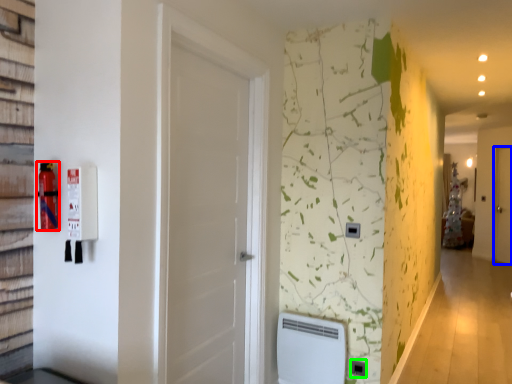
Question: Which object is positioned farthest from extinguisher (highlighted by a red box)? Select from door (highlighted by a blue box) and electric outlet (highlighted by a green box).

Choices:
 (A) door
 (B) electric outlet

Answer: (A)